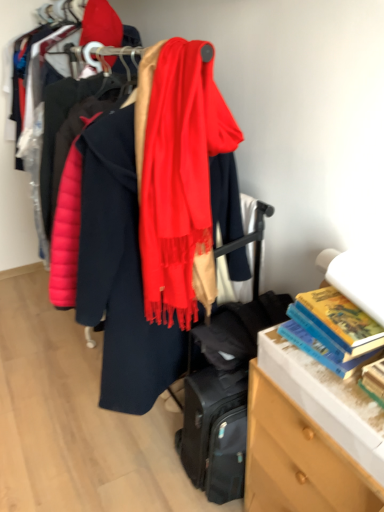
Question: Is hardcover book at right, acting as the second book starting from the back, outside of silky red scarf at center?

Choices:
 (A) no
 (B) yes

Answer: (B)

Question: Is silky red scarf at center completely or partially inside hardcover book at right, acting as the second book starting from the back?

Choices:
 (A) yes
 (B) no

Answer: (B)

Question: Is hardcover book at right, the first book when ordered from front to back, closer to the viewer compared to silky red scarf at center?

Choices:
 (A) yes
 (B) no

Answer: (A)

Question: Is hardcover book at right, the first book when ordered from front to back, at the right side of silky red scarf at center?

Choices:
 (A) yes
 (B) no

Answer: (A)

Question: Can you confirm if hardcover book at right, acting as the second book starting from the back, is wider than silky red scarf at center?

Choices:
 (A) no
 (B) yes

Answer: (A)

Question: Is hardcover book at right, acting as the second book starting from the back, further to camera compared to silky red scarf at center?

Choices:
 (A) yes
 (B) no

Answer: (B)

Question: Is silky red scarf at center positioned before hardcover book at right, acting as the second book starting from the back?

Choices:
 (A) no
 (B) yes

Answer: (A)

Question: Can you confirm if silky red scarf at center is shorter than hardcover book at right, the first book when ordered from front to back?

Choices:
 (A) no
 (B) yes

Answer: (A)

Question: From a real-world perspective, is silky red scarf at center under hardcover book at right, acting as the second book starting from the back?

Choices:
 (A) no
 (B) yes

Answer: (A)

Question: Is silky red scarf at center positioned far away from hardcover book at right, acting as the second book starting from the back?

Choices:
 (A) yes
 (B) no

Answer: (B)

Question: Considering the relative sizes of silky red scarf at center and hardcover book at right, the first book when ordered from front to back, in the image provided, is silky red scarf at center taller than hardcover book at right, the first book when ordered from front to back,?

Choices:
 (A) no
 (B) yes

Answer: (B)

Question: Is silky red scarf at center to the left of hardcover book at right, the first book when ordered from front to back, from the viewer's perspective?

Choices:
 (A) no
 (B) yes

Answer: (B)

Question: Could you tell me if silky red scarf at center is facing hardcover book at right, the 1th book positioned from the back?

Choices:
 (A) no
 (B) yes

Answer: (A)